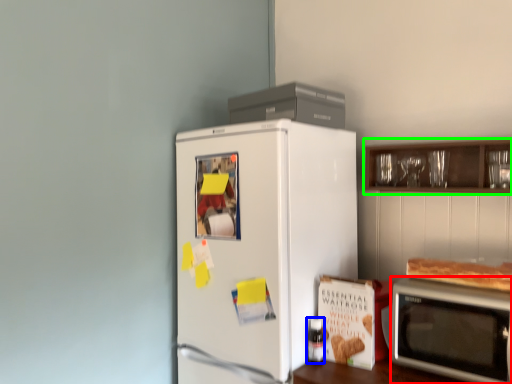
Question: Which object is positioned farthest from microwave oven (highlighted by a red box)? Select from bottle (highlighted by a blue box) and cabinetry (highlighted by a green box).

Choices:
 (A) bottle
 (B) cabinetry

Answer: (B)